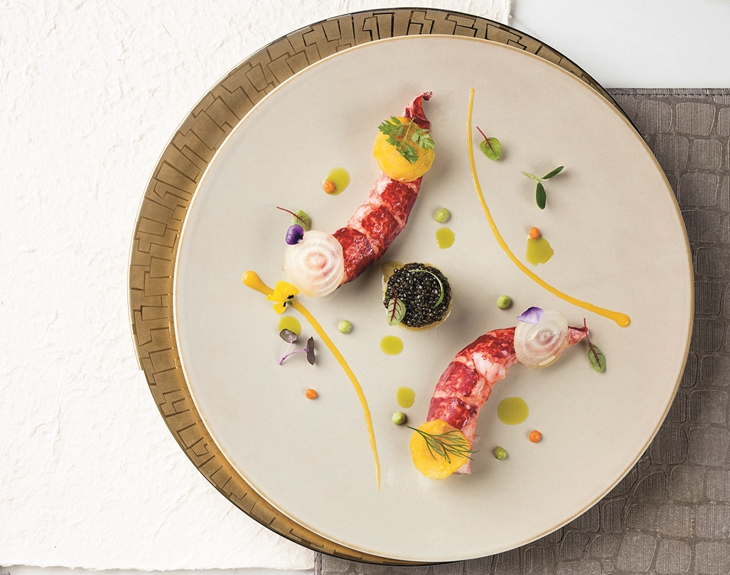
The width and height of the screenshot is (730, 575). Identify the location of table. (682, 532).